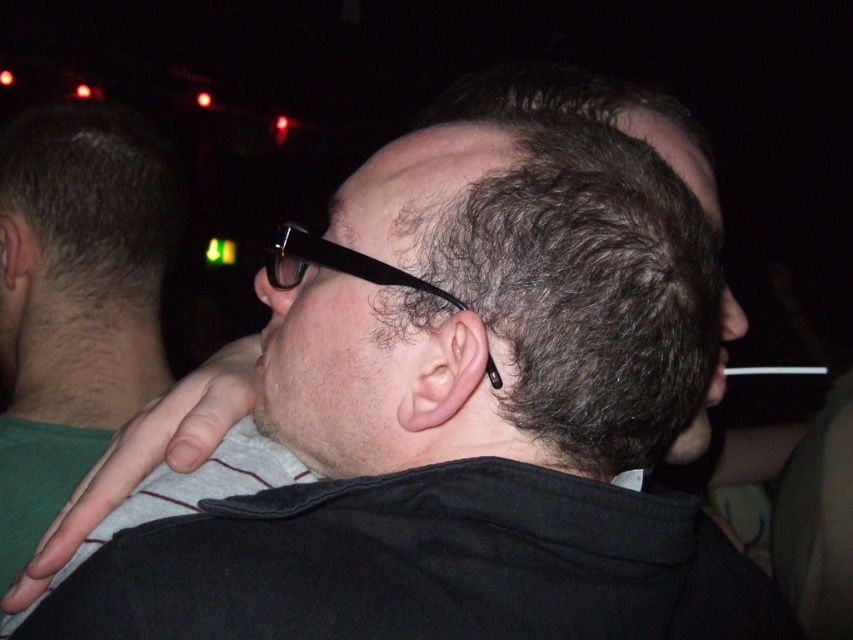
Question: Which point is farther to the camera?

Choices:
 (A) black matte cigarette at center
 (B) matte black ear at center
 (C) black plastic glasses at center
 (D) skinny ear at center

Answer: (A)

Question: Which point is farther from the camera taking this photo?

Choices:
 (A) (755, 372)
 (B) (30, 266)
 (C) (364, 273)

Answer: (A)

Question: Where is skinny ear at center located in relation to black matte cigarette at center in the image?

Choices:
 (A) below
 (B) above

Answer: (B)

Question: Is matte black ear at center bigger than black matte cigarette at center?

Choices:
 (A) yes
 (B) no

Answer: (B)

Question: Which point appears closest to the camera in this image?

Choices:
 (A) (469, 378)
 (B) (15, 241)
 (C) (811, 372)
 (D) (376, 268)

Answer: (A)

Question: Is dark matte hair at center above black matte cigarette at center?

Choices:
 (A) yes
 (B) no

Answer: (A)